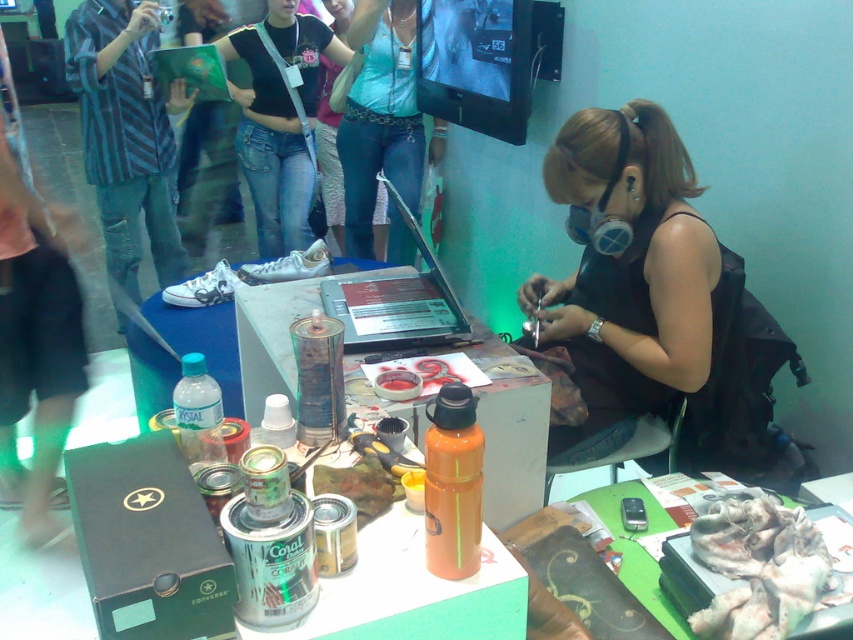
Question: Estimate the real-world distances between objects in this image. Which object is closer to the orange matte water bottle at lower right?

Choices:
 (A) blue denim jeans at center
 (B) fuzzy white fabric at lower right

Answer: (B)

Question: Does matte black tank top at center have a greater width compared to fuzzy white fabric at lower right?

Choices:
 (A) yes
 (B) no

Answer: (A)

Question: Observing the image, what is the correct spatial positioning of matte black tank top at center in reference to fuzzy white fabric at lower right?

Choices:
 (A) below
 (B) above

Answer: (B)

Question: Does matte black tank top at center come behind blue denim jeans at center?

Choices:
 (A) yes
 (B) no

Answer: (B)

Question: Which point appears farthest from the camera in this image?

Choices:
 (A) (784, 538)
 (B) (561, 138)

Answer: (B)

Question: Which object appears closest to the camera in this image?

Choices:
 (A) fuzzy white fabric at lower right
 (B) matte black tank top at center

Answer: (A)